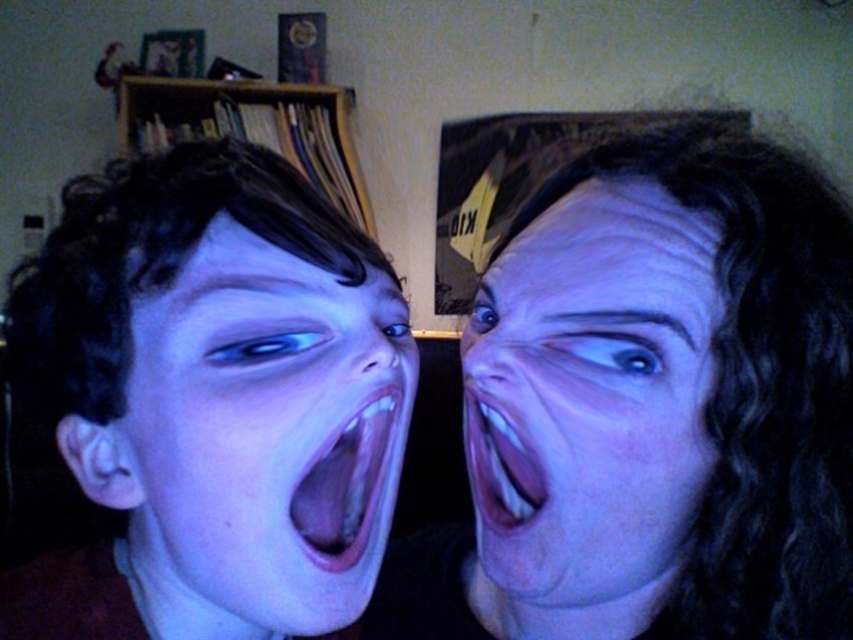
Question: Can you confirm if blue matte face at left is positioned below matte skin face at right?

Choices:
 (A) no
 (B) yes

Answer: (B)

Question: Which object is closer to the camera taking this photo?

Choices:
 (A) blue matte face at left
 (B) matte skin face at right
 (C) pink flesh-colored mouth at center
 (D) matte black hair at right

Answer: (A)

Question: Does matte black hair at right have a smaller size compared to purple glossy tongue at center?

Choices:
 (A) yes
 (B) no

Answer: (B)

Question: Can you confirm if matte black hair at right is thinner than matte skin face at right?

Choices:
 (A) yes
 (B) no

Answer: (B)

Question: Estimate the real-world distances between objects in this image. Which object is farther from the matte skin face at right?

Choices:
 (A) blue matte face at left
 (B) purple glossy tongue at center

Answer: (A)

Question: Considering the real-world distances, which object is farthest from the matte skin face at right?

Choices:
 (A) matte black hair at right
 (B) pink flesh-colored mouth at center
 (C) blue matte face at left

Answer: (C)